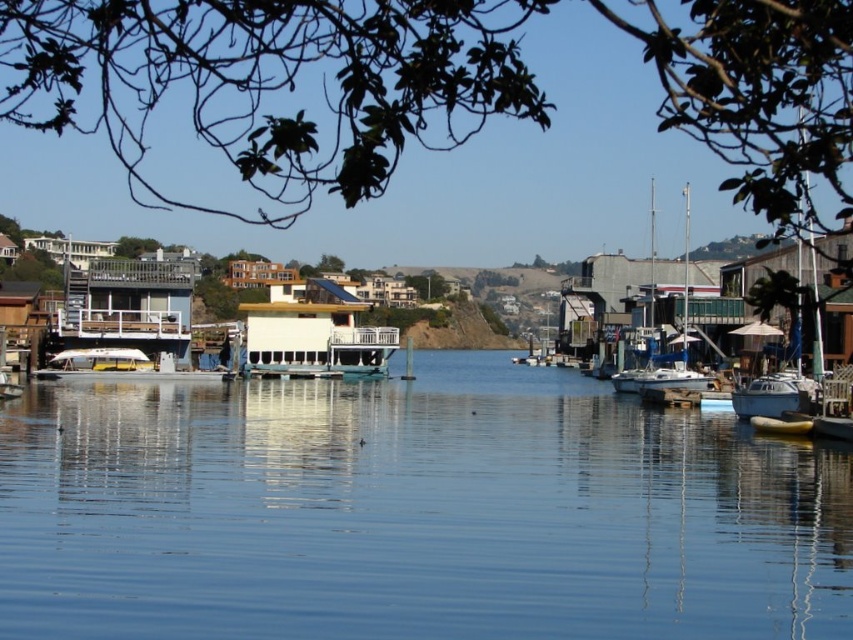
You are a photographer planning to capture a reflection of the houseboats on the clear blue water at center. Based on the water surface conditions described, will the reflection be sharp and clear?

The clear blue water at center has a slightly rippled surface, so the reflection of the houseboats will not be perfectly sharp and clear due to the gentle breeze causing ripples.